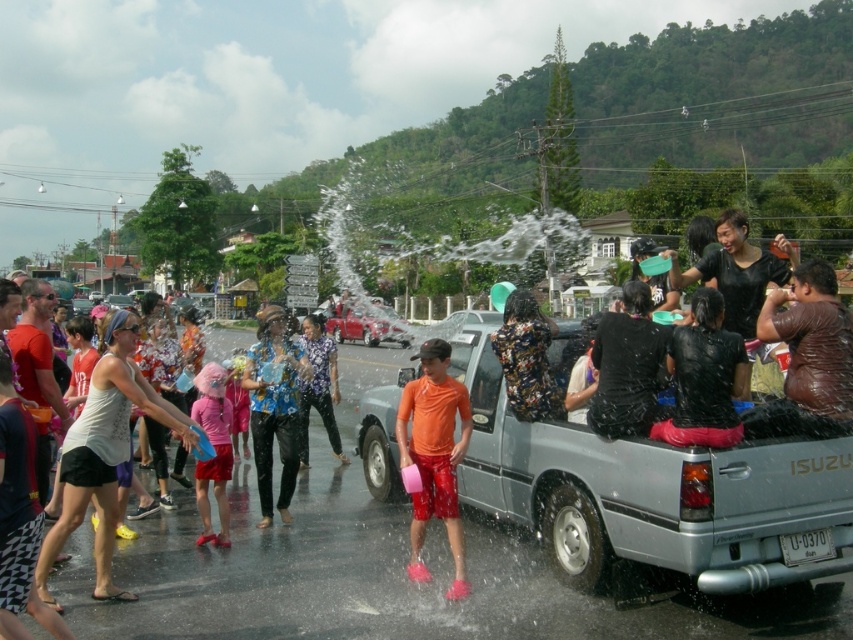
Question: Can you confirm if orange matte shirt at center is positioned to the left of floral fabric shirt at center?

Choices:
 (A) no
 (B) yes

Answer: (A)

Question: Which object is positioned closest to the silver metallic truck at center?

Choices:
 (A) white cotton tank top at center
 (B) orange matte shirt at center
 (C) floral fabric shirt at center

Answer: (B)

Question: Is silver metallic truck at center to the left of floral fabric shirt at center from the viewer's perspective?

Choices:
 (A) no
 (B) yes

Answer: (A)

Question: Estimate the real-world distances between objects in this image. Which object is farther from the white cotton tank top at center?

Choices:
 (A) floral fabric shirt at center
 (B) silver metallic truck at center
 (C) orange matte shirt at center

Answer: (B)

Question: Which of the following is the farthest from the observer?

Choices:
 (A) (767, 481)
 (B) (61, 524)

Answer: (B)

Question: Can you confirm if silver metallic truck at center is wider than orange matte shirt at center?

Choices:
 (A) no
 (B) yes

Answer: (A)